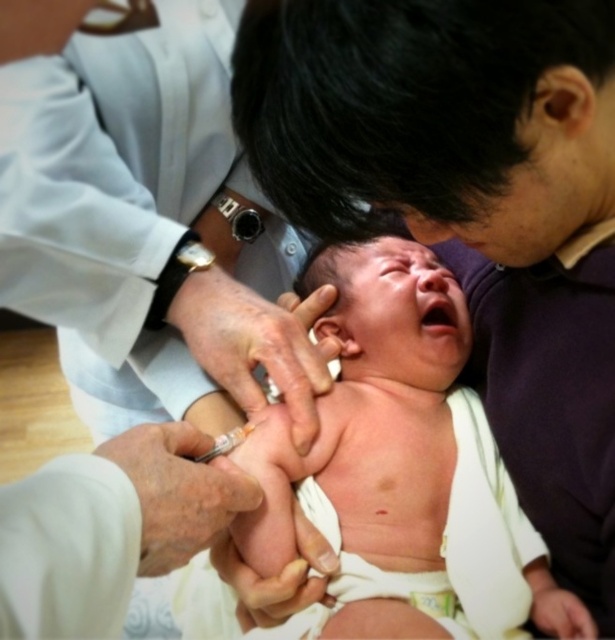
Based on the scene description, where is the pink smooth skin at center located in terms of coordinates?

The pink smooth skin at center is located at point coordinates of (371, 413).

You are a healthcare professional in a medical facility. You need to ensure that the white smooth coat at upper left is at least 6 inches away from the pink smooth skin at center to prevent contamination. Based on the image, is the current distance sufficient?

The white smooth coat at upper left is 6.71 inches from the pink smooth skin at center, which meets the requirement of being at least 6 inches away. Therefore, the distance is sufficient to prevent contamination.